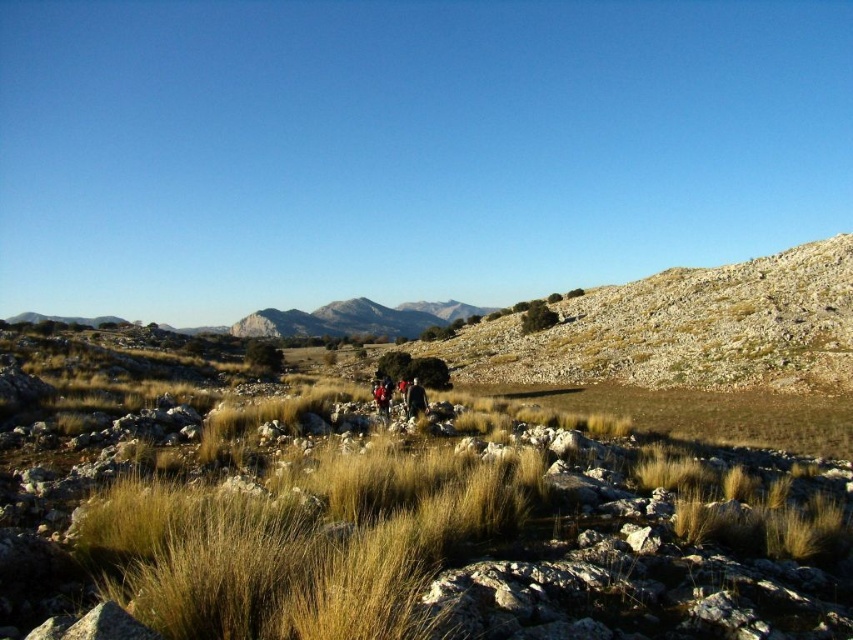
Is rugged brown mountain at center to the right of dark brown leather jacket at center from the viewer's perspective?

No, rugged brown mountain at center is not to the right of dark brown leather jacket at center.

Locate an element on the screen. This screenshot has height=640, width=853. rugged brown mountain at center is located at coordinates (352, 320).

Between point (410, 304) and point (405, 400), which one is positioned in front?

Point (405, 400) is in front.

Identify the location of rugged brown mountain at center. (352, 320).

Looking at this image, who is higher up, dry grass at center or red fabric person at center?

red fabric person at center

Between dry grass at center and red fabric person at center, which one appears on the right side from the viewer's perspective?

From the viewer's perspective, dry grass at center appears more on the right side.

Between point (181, 506) and point (379, 406), which one is positioned behind?

The point (379, 406) is more distant.

Where is `dry grass at center`? The image size is (853, 640). dry grass at center is located at coordinates (473, 534).

Which is in front, point (340, 323) or point (375, 392)?

Positioned in front is point (375, 392).

Which is in front, point (439, 301) or point (387, 380)?

Point (387, 380)

Identify the location of rugged brown mountain at center. (352, 320).